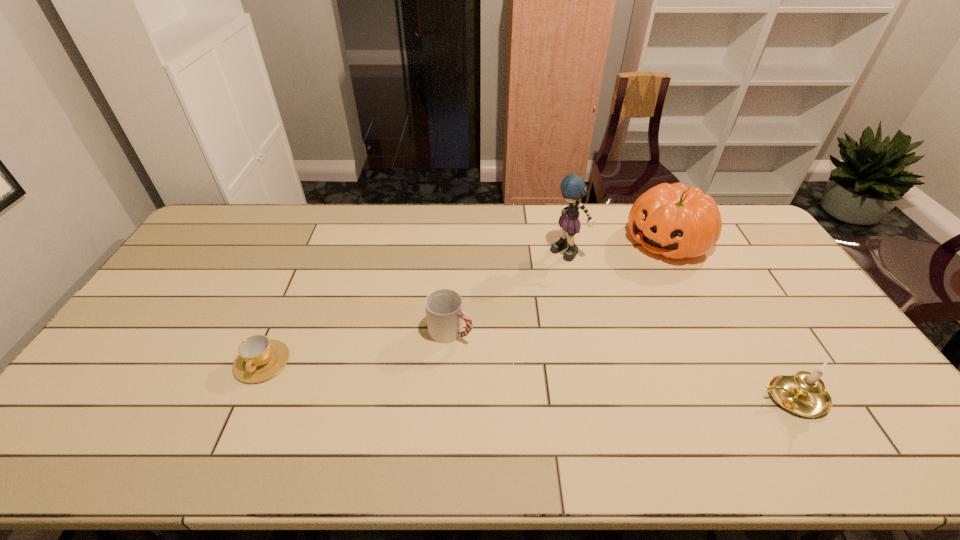
At what (x,y) coordinates should I click in order to perform the action: click on free space located on the side of the right cup where the handle is located. Please return your answer as a coordinate pair (x, y). The image size is (960, 540). Looking at the image, I should click on (495, 354).

Locate an element on the screen. The image size is (960, 540). object that is at the far edge is located at coordinates (676, 221).

I want to click on object positioned at the near edge, so click(x=804, y=393).

Where is `object situated at the right edge`? The height and width of the screenshot is (540, 960). object situated at the right edge is located at coordinates (804, 393).

Locate an element on the screen. object at the near right corner is located at coordinates (804, 393).

Identify the location of vacant space at the far edge of the desktop. This screenshot has height=540, width=960. (490, 239).

The image size is (960, 540). I want to click on free region at the near edge of the desktop, so click(x=442, y=396).

The width and height of the screenshot is (960, 540). I want to click on free space at the left edge of the desktop, so click(x=154, y=366).

Image resolution: width=960 pixels, height=540 pixels. In the image, there is a desktop. What are the coordinates of `vacant space at the right edge` in the screenshot? It's located at (812, 368).

In the image, there is a desktop. At what (x,y) coordinates should I click in order to perform the action: click on free space at the far left corner. Please return your answer as a coordinate pair (x, y). This screenshot has height=540, width=960. Looking at the image, I should click on (213, 221).